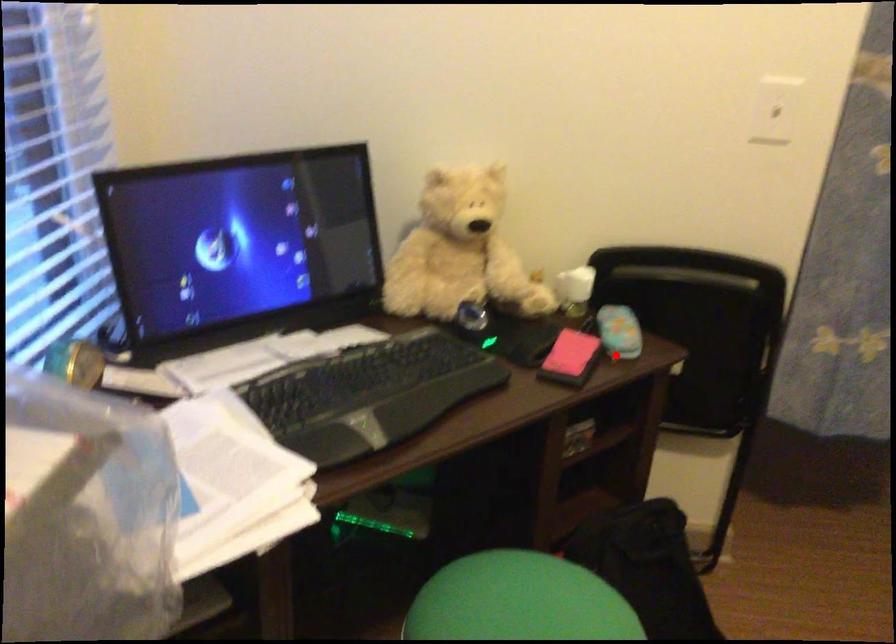
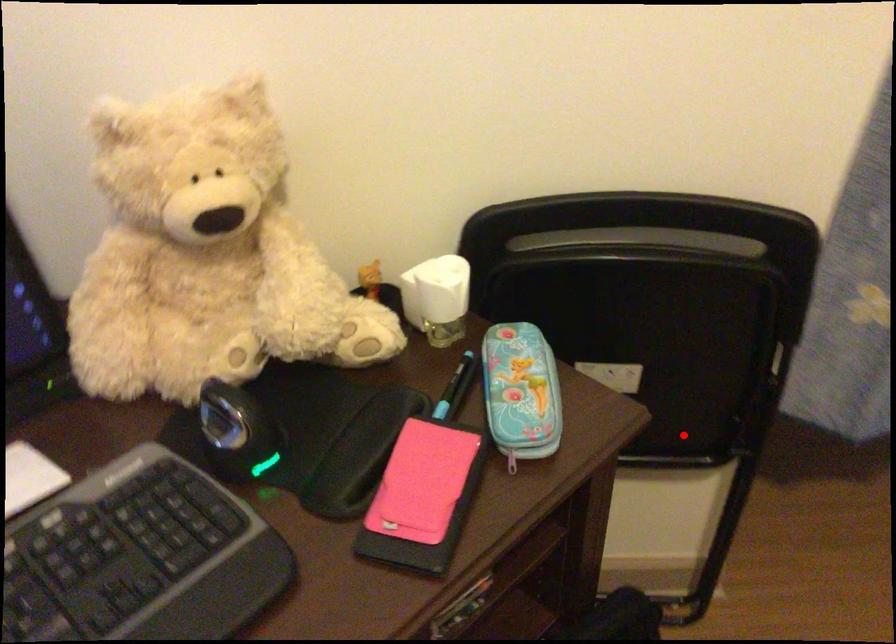
Looking at this image, I am providing you with two images of the same scene from different viewpoints. A red point is marked on the first image and another point is marked on the second image. Is the marked point in image1 the same physical position as the marked point in image2?

No